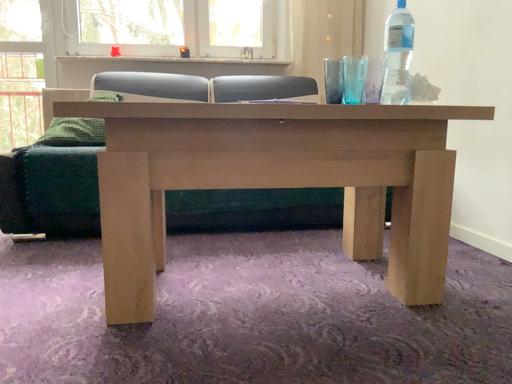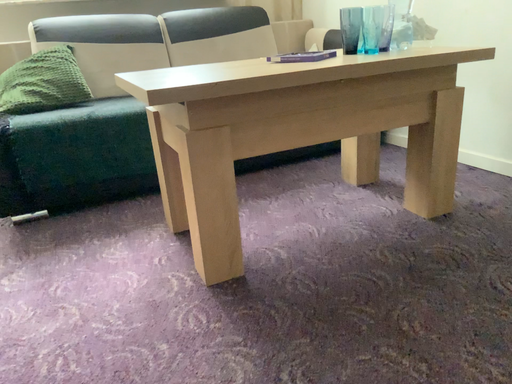
Question: How did the camera likely rotate when shooting the video?

Choices:
 (A) rotated right
 (B) rotated left

Answer: (A)